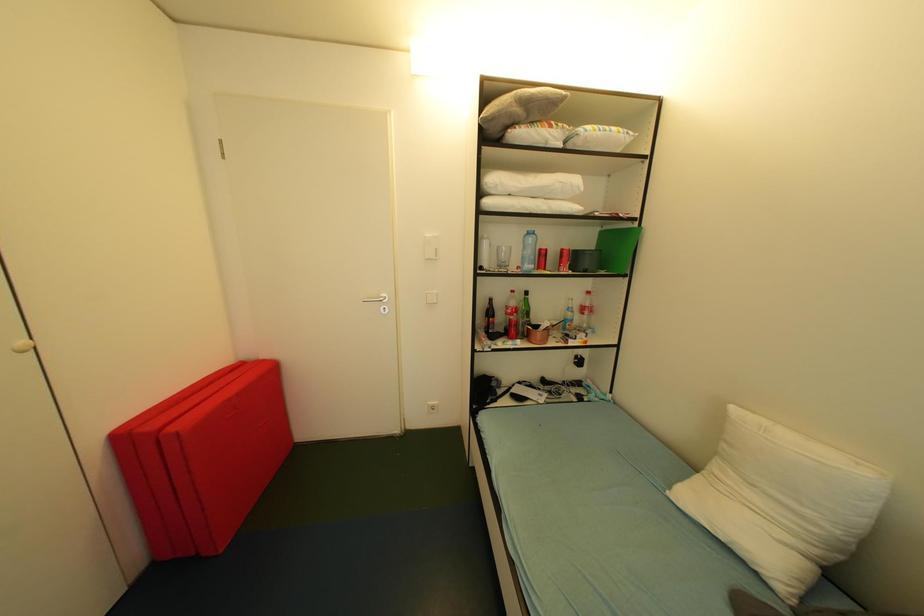
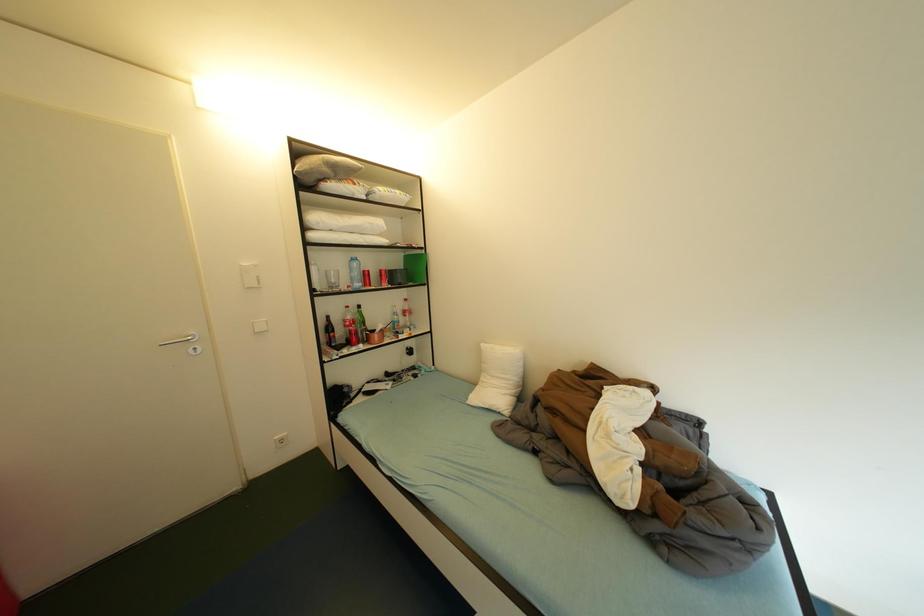
Question: The camera is either moving clockwise (left) or counter-clockwise (right) around the object. The first image is from the beginning of the video and the second image is from the end. Is the camera moving left or right when shooting the video?

Choices:
 (A) Left
 (B) Right

Answer: (A)